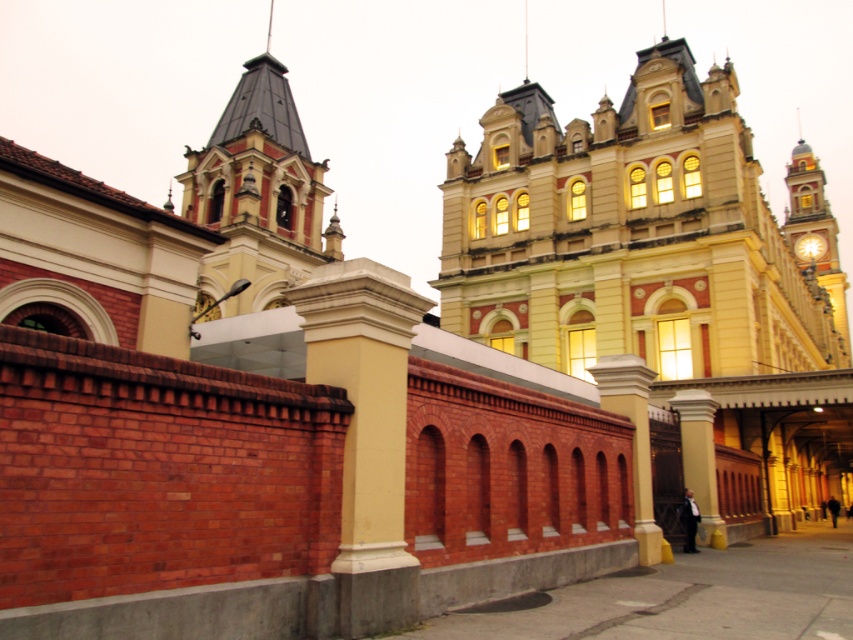
Question: Is white stone column at center bigger than shiny copper spire at upper center?

Choices:
 (A) yes
 (B) no

Answer: (B)

Question: In this image, where is yellow polished stone pillar at center located relative to goldmetallicclock tower at right?

Choices:
 (A) left
 (B) right

Answer: (A)

Question: Where is beige stone church at center located in relation to white stone column at center in the image?

Choices:
 (A) below
 (B) above

Answer: (B)

Question: Based on their relative distances, which object is nearer to the white stone column at center?

Choices:
 (A) gold metallic clock at upper right
 (B) matte red brick tower at upper left

Answer: (B)

Question: Which object appears closest to the camera in this image?

Choices:
 (A) white stone column at center
 (B) shiny copper spire at upper center
 (C) goldmetallicclock tower at right

Answer: (A)

Question: Which of these objects is positioned closest to the white stone column at center?

Choices:
 (A) shiny copper spire at upper center
 (B) white marble column at center
 (C) shiny metallic spire at upper center
 (D) gold metallic clock at upper right

Answer: (B)